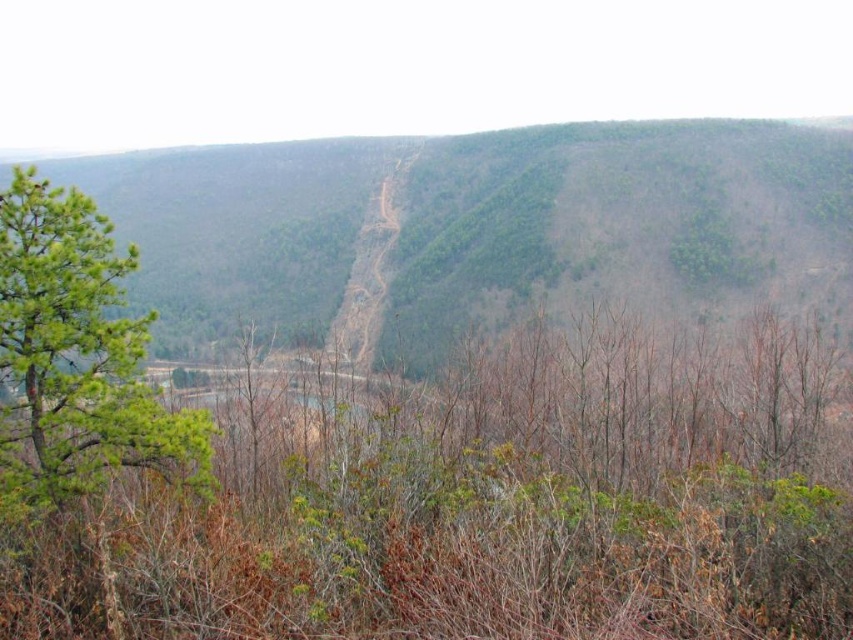
Question: Can you confirm if green leafy hillside at center is bigger than green needle-like tree at left?

Choices:
 (A) no
 (B) yes

Answer: (B)

Question: Is green leafy hillside at center thinner than green needle-like tree at left?

Choices:
 (A) no
 (B) yes

Answer: (A)

Question: Which object is positioned farthest from the green leafy hillside at center?

Choices:
 (A) green needle-like tree at left
 (B) brown dirt path at center

Answer: (A)

Question: Which point is closer to the camera taking this photo?

Choices:
 (A) (50, 276)
 (B) (374, 316)
 (C) (515, 209)

Answer: (A)

Question: Does green leafy hillside at center appear over green needle-like tree at left?

Choices:
 (A) no
 (B) yes

Answer: (B)

Question: Which point is closer to the camera taking this photo?

Choices:
 (A) (357, 266)
 (B) (842, 205)

Answer: (B)